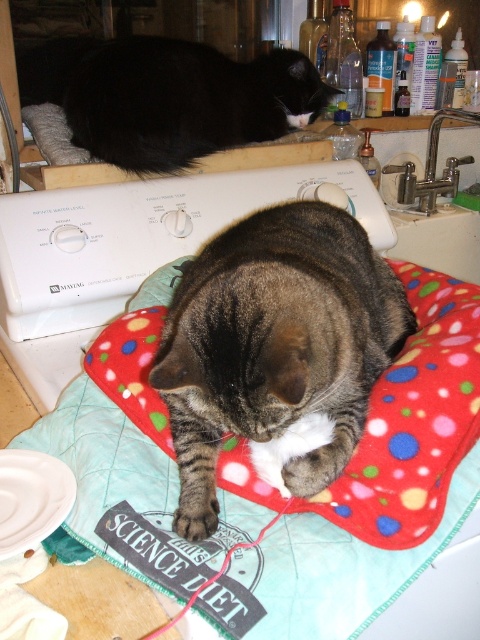
Question: Does black fur cat at upper left have a smaller size compared to brushed metal sink at upper right?

Choices:
 (A) yes
 (B) no

Answer: (A)

Question: Which object appears closest to the camera in this image?

Choices:
 (A) polka dot fleece pillow at center
 (B) tabby fur cat at center
 (C) black fur cat at upper left

Answer: (B)

Question: Can you confirm if tabby fur cat at center is positioned to the left of black fur cat at upper left?

Choices:
 (A) yes
 (B) no

Answer: (B)

Question: Does polka dot fleece pillow at center appear under black fur cat at upper left?

Choices:
 (A) yes
 (B) no

Answer: (A)

Question: Which of the following is the closest to the observer?

Choices:
 (A) (69, 102)
 (B) (322, 579)

Answer: (B)

Question: Which object is closer to the camera taking this photo?

Choices:
 (A) white plastic sewing machine at upper center
 (B) brushed metal sink at upper right
 (C) black fur cat at upper left
 (D) tabby fur cat at center

Answer: (D)